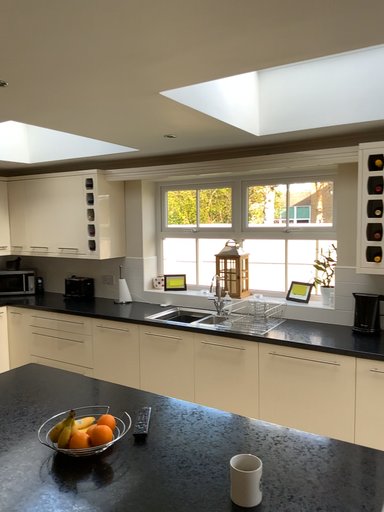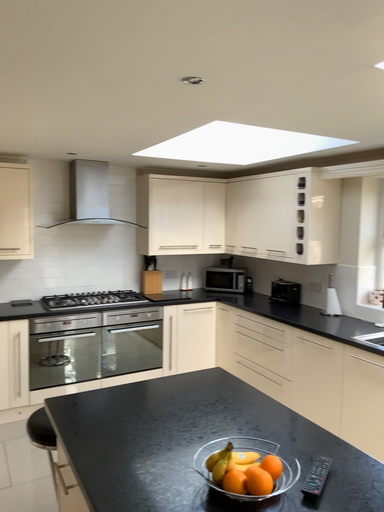
Question: Which way did the camera rotate in the video?

Choices:
 (A) rotated left
 (B) rotated right

Answer: (A)